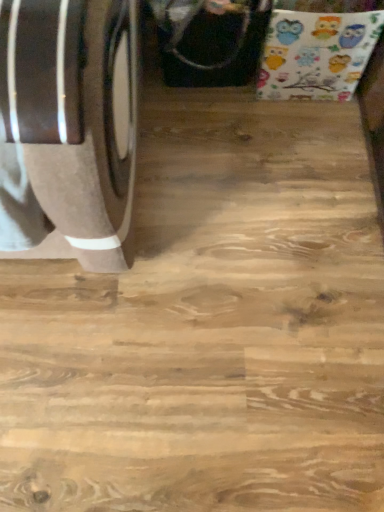
Locate an element on the screen. This screenshot has height=512, width=384. white paperboard box with colorful owl stickers at upper right is located at coordinates (316, 54).

What do you see at coordinates (316, 54) in the screenshot?
I see `white paperboard box with colorful owl stickers at upper right` at bounding box center [316, 54].

Where is `white paperboard box with colorful owl stickers at upper right`? This screenshot has height=512, width=384. white paperboard box with colorful owl stickers at upper right is located at coordinates [316, 54].